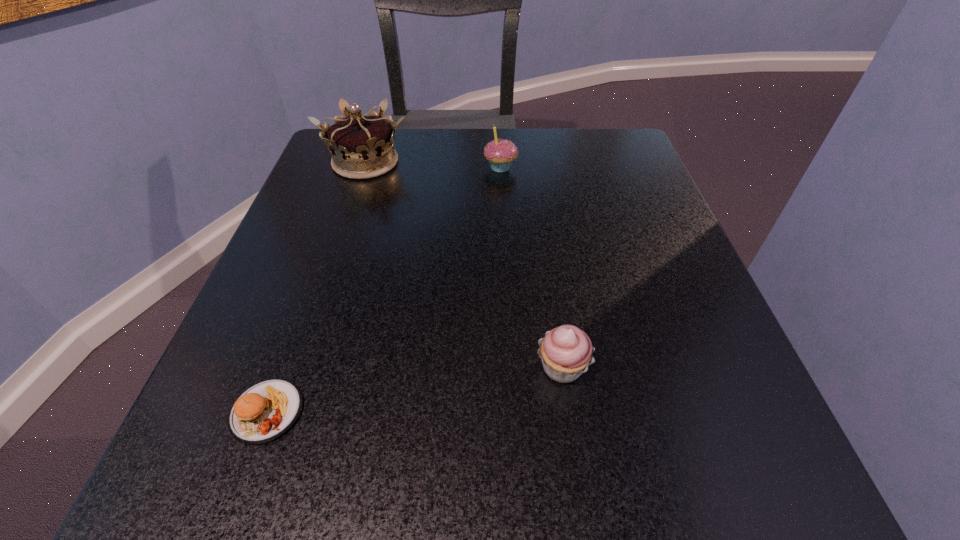
At what (x,y) coordinates should I click in order to perform the action: click on the tallest object. Please return your answer as a coordinate pair (x, y). Looking at the image, I should click on (362, 147).

You are a GUI agent. You are given a task and a screenshot of the screen. Output one action in this format:
    pyautogui.click(x=<x>, y=<y>)
    Task: Click on the second tallest object
    Image resolution: width=960 pixels, height=540 pixels.
    Given the screenshot: What is the action you would take?
    pyautogui.click(x=500, y=153)

At what (x,y) coordinates should I click in order to perform the action: click on the taller cupcake. Please return your answer as a coordinate pair (x, y). The width and height of the screenshot is (960, 540). Looking at the image, I should click on (500, 153).

Image resolution: width=960 pixels, height=540 pixels. Identify the location of the shorter cupcake. (566, 351).

Locate an element on the screen. The height and width of the screenshot is (540, 960). the third tallest object is located at coordinates (x=566, y=351).

Locate an element on the screen. The height and width of the screenshot is (540, 960). patty is located at coordinates (265, 411).

Locate an element on the screen. free space located 0.370m on the right of the crown is located at coordinates (585, 162).

At what (x,y) coordinates should I click in order to perform the action: click on vacant area situated 0.140m on the right of the second tallest object. Please return your answer as a coordinate pair (x, y). Image resolution: width=960 pixels, height=540 pixels. Looking at the image, I should click on (584, 167).

Where is `free space located 0.280m on the back of the second shortest object`? The image size is (960, 540). free space located 0.280m on the back of the second shortest object is located at coordinates (540, 218).

Identify the location of free point located on the back of the patty. The height and width of the screenshot is (540, 960). (334, 224).